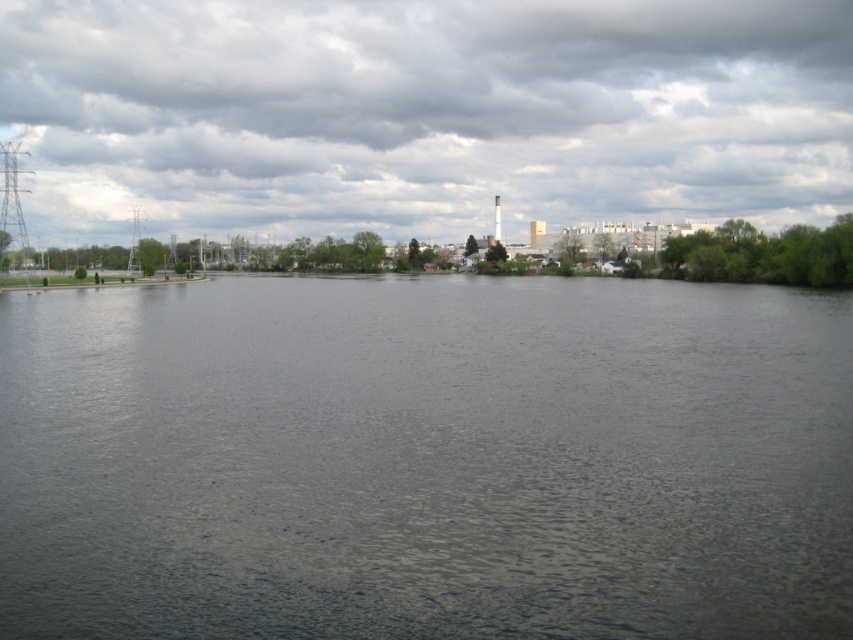
Is dark gray water at center taller than dark cloudy sky at upper center?

No.

Can you confirm if dark gray water at center is positioned below dark cloudy sky at upper center?

Yes, dark gray water at center is below dark cloudy sky at upper center.

Is point (380, 621) positioned after point (276, 128)?

No, (380, 621) is in front of (276, 128).

The height and width of the screenshot is (640, 853). I want to click on dark gray water at center, so click(425, 460).